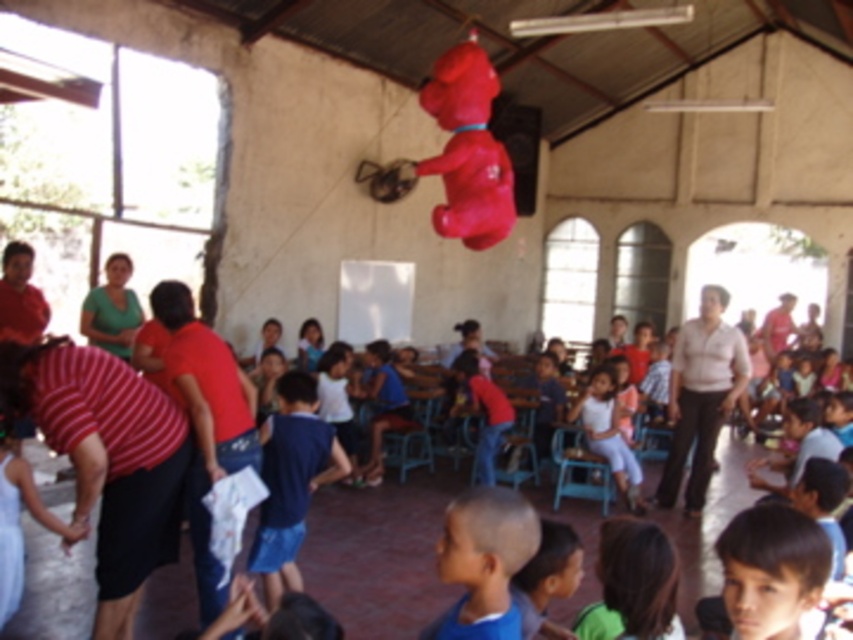
Question: In this image, where is white cotton dress at lower left located relative to white matte pants at center?

Choices:
 (A) above
 (B) below

Answer: (A)

Question: In this image, where is brown hair at lower right located relative to white cotton dress at lower left?

Choices:
 (A) left
 (B) right

Answer: (B)

Question: Can you confirm if rubber dog at upper center is bigger than brown hair at lower right?

Choices:
 (A) yes
 (B) no

Answer: (A)

Question: Which point is closer to the camera?

Choices:
 (A) white matte pants at center
 (B) rubber dog at upper center
 (C) white cotton dress at lower left

Answer: (C)

Question: Which point is closer to the camera taking this photo?

Choices:
 (A) (0, 497)
 (B) (590, 436)
 (C) (561, 470)
 (D) (479, 195)

Answer: (A)

Question: Based on their relative distances, which object is farther from the white cotton dress at lower left?

Choices:
 (A) brown hair at lower right
 (B) rubber dog at upper center

Answer: (B)